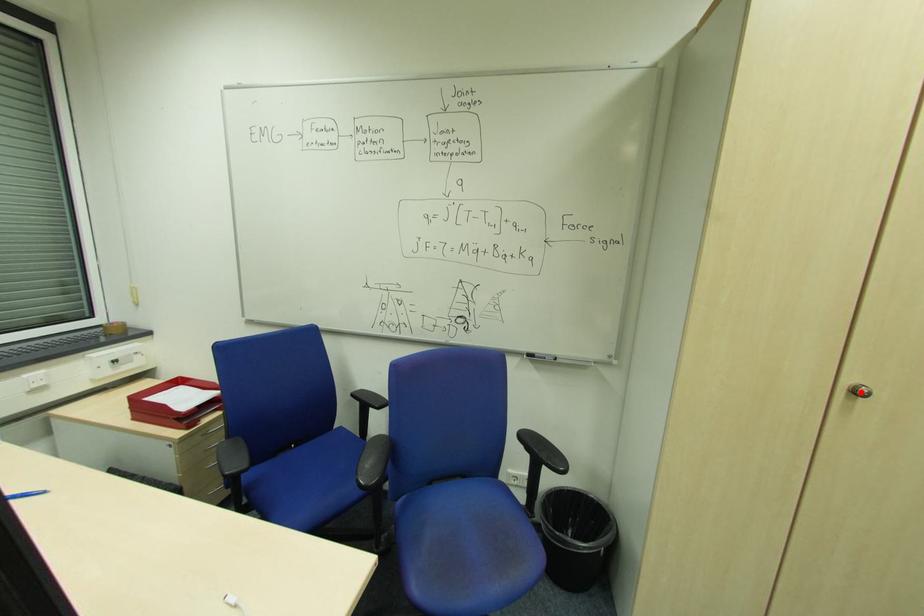
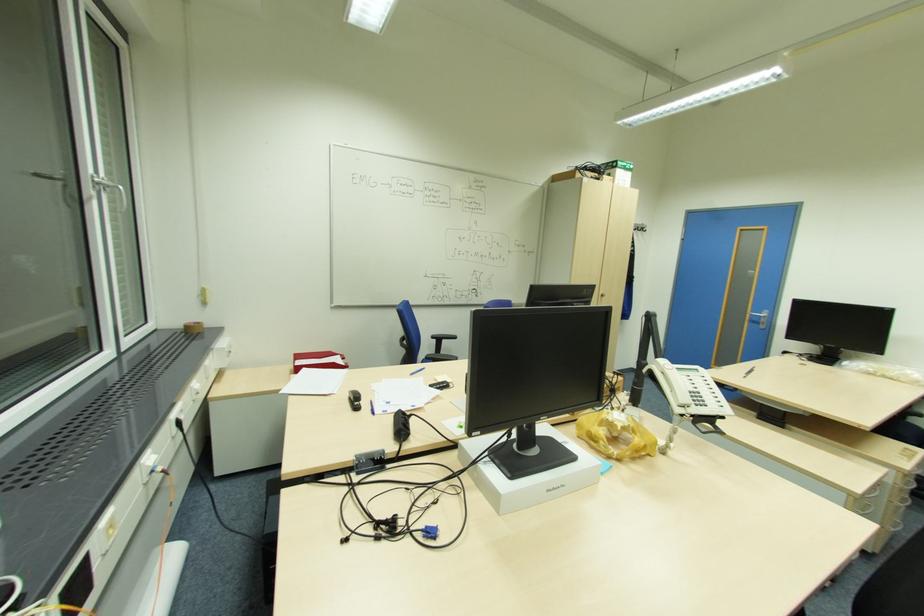
In the second image, find the point that corresponds to the highlighted location in the first image.

(604, 294)